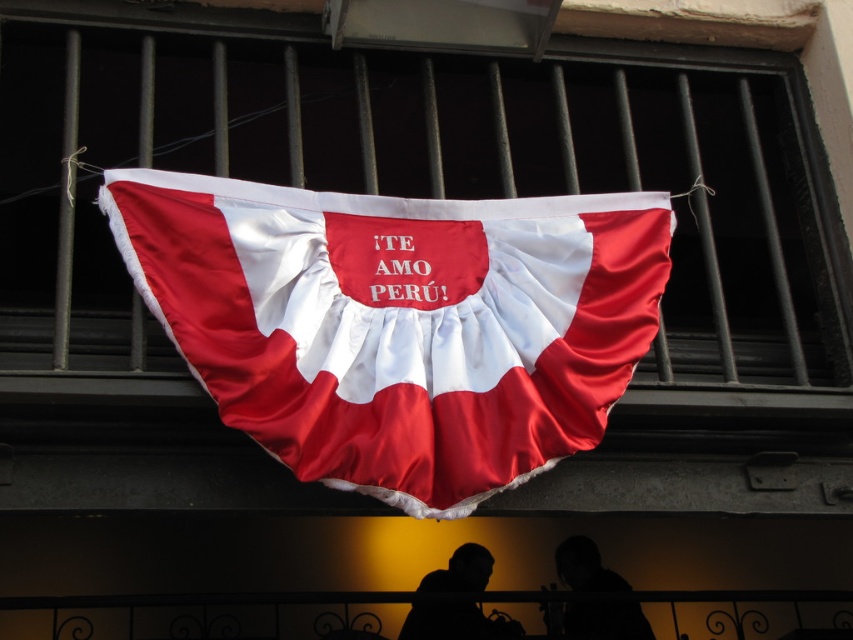
You are a photographer standing in front of the black metal balcony railing. You want to take a photo that includes both the silky satin flag at center and the silhouette figure at center. Which object should you focus on first to ensure both are in sharp focus?

You should focus on the silky satin flag at center first because it is closer to the viewer than the silhouette figure at center. By focusing on the closer object, the depth of field may still capture the silhouette figure at center in focus as well.

You are standing in front of the banner and want to take a photo of the silhouette figure at center without the matte fabric banner at center appearing in the shot. Which direction should you move to achieve this?

Move to the left side of the silhouette figure at center to avoid the matte fabric banner at center, since the banner is positioned to the right of the figure.